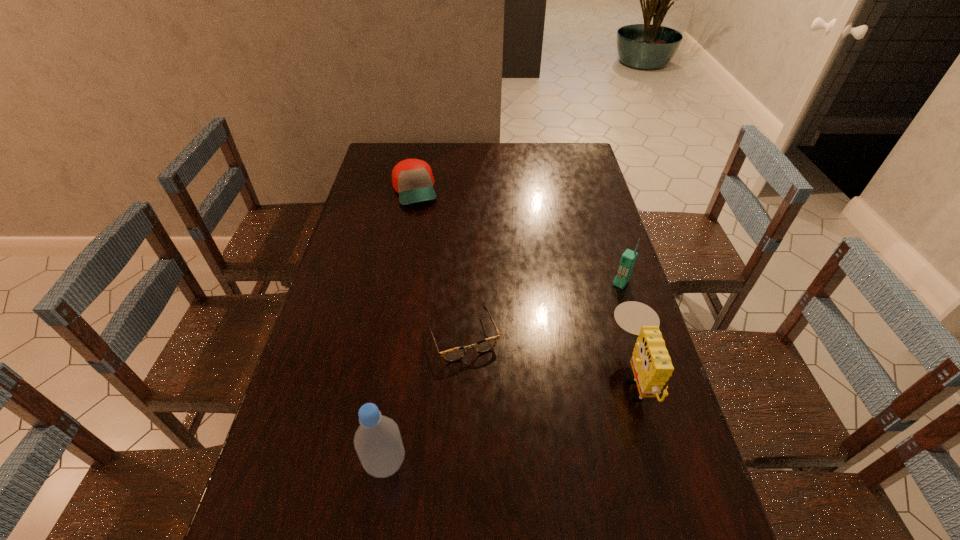
Locate an element on the screen. Image resolution: width=960 pixels, height=540 pixels. empty space that is in between the sponge and the bottle is located at coordinates (510, 419).

Identify the location of vacant area that lies between the tallest object and the third object from right to left. (424, 400).

Find the location of a particular element. The width and height of the screenshot is (960, 540). free space between the spectacles and the baseball cap is located at coordinates (439, 264).

Where is `vacant area that lies between the nearest object and the spectacles`? vacant area that lies between the nearest object and the spectacles is located at coordinates (424, 400).

Find the location of a particular element. free area in between the sponge and the shortest object is located at coordinates (548, 356).

Locate an element on the screen. unoccupied position between the bottle and the fourth nearest object is located at coordinates (503, 373).

This screenshot has width=960, height=540. Find the location of `free space between the nearest object and the farthest object`. free space between the nearest object and the farthest object is located at coordinates (400, 327).

Select which object appears as the second closest to the cellular telephone. Please provide its 2D coordinates. Your answer should be formatted as a tuple, i.e. [(x, y)], where the tuple contains the x and y coordinates of a point satisfying the conditions above.

[(452, 355)]

Where is `the second closest object relative to the cellular telephone`? The image size is (960, 540). the second closest object relative to the cellular telephone is located at coordinates (452, 355).

You are a GUI agent. You are given a task and a screenshot of the screen. Output one action in this format:
    pyautogui.click(x=<x>, y=<y>)
    Task: Click on the free space that satisfies the following two spatial constraints: 1. on the back side of the nearest object; 2. on the front-facing side of the sponge
    Image resolution: width=960 pixels, height=540 pixels.
    Given the screenshot: What is the action you would take?
    pyautogui.click(x=398, y=376)